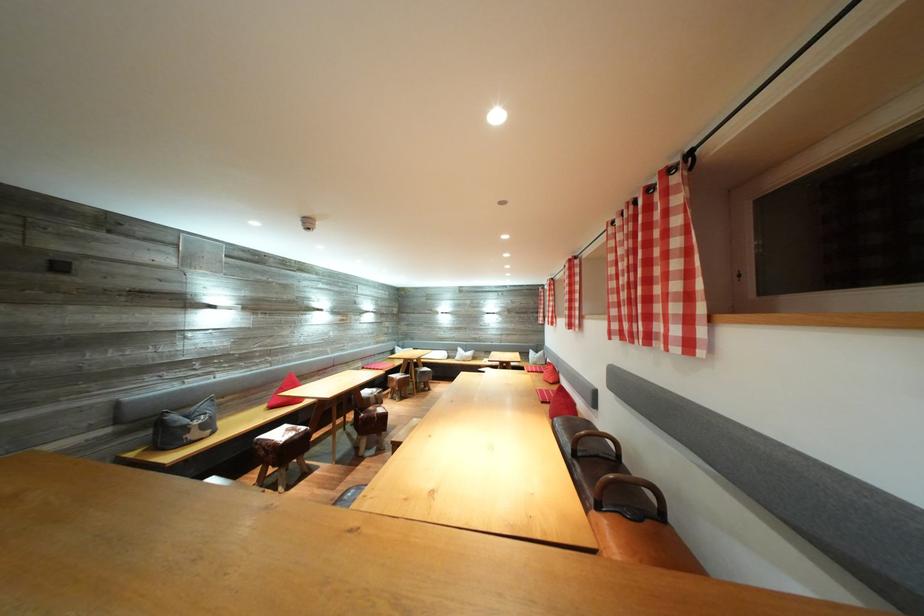
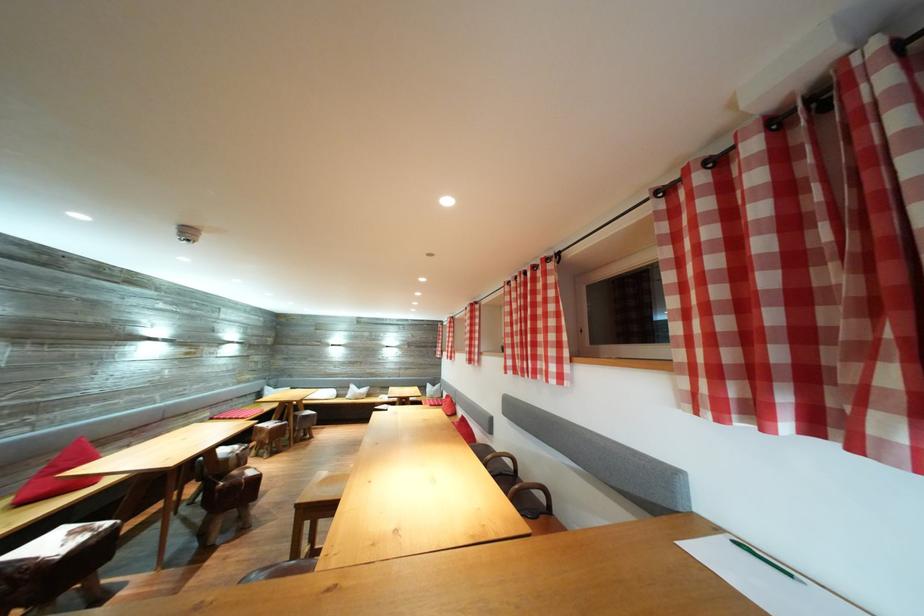
Locate, in the second image, the point that corresponds to pixel 378 414 in the first image.

(241, 477)